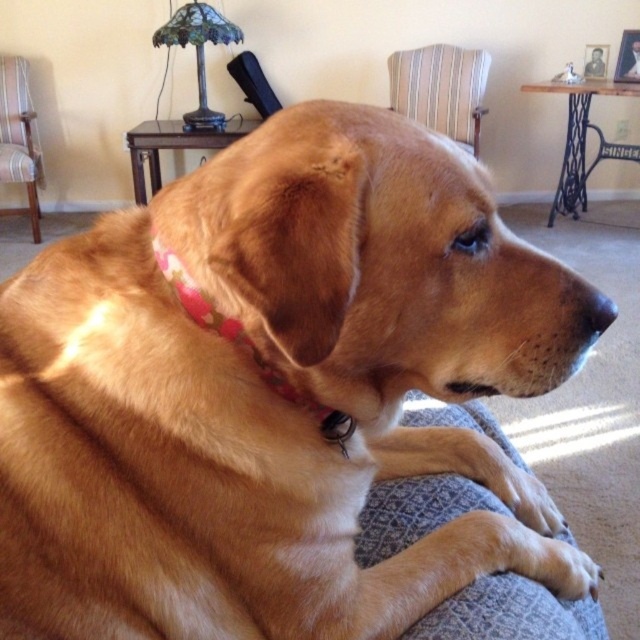
In the scene shown: Can you confirm if gray fabric dog bed at lower center is positioned below striped fabric armchair at upper center?

Indeed, gray fabric dog bed at lower center is positioned under striped fabric armchair at upper center.

Which is behind, point (460, 612) or point (483, 76)?

The point (483, 76) is behind.

At what (x,y) coordinates should I click in order to perform the action: click on gray fabric dog bed at lower center. Please return your answer as a coordinate pair (x, y). Image resolution: width=640 pixels, height=640 pixels. Looking at the image, I should click on (509, 612).

The width and height of the screenshot is (640, 640). Describe the element at coordinates (509, 612) in the screenshot. I see `gray fabric dog bed at lower center` at that location.

Which is above, gray fabric dog bed at lower center or floral fabric bandana at center?

Positioned higher is floral fabric bandana at center.

Between point (538, 600) and point (154, 241), which one is positioned in front?

Point (154, 241) is more forward.

Identify the location of gray fabric dog bed at lower center. This screenshot has width=640, height=640. (509, 612).

Is striped fabric armchair at upper center below floral fabric bandana at center?

Actually, striped fabric armchair at upper center is above floral fabric bandana at center.

Can you confirm if striped fabric armchair at upper center is thinner than floral fabric bandana at center?

In fact, striped fabric armchair at upper center might be wider than floral fabric bandana at center.

Between point (403, 83) and point (276, 378), which one is positioned behind?

Point (403, 83)

Find the location of `striped fabric armchair at upper center`. striped fabric armchair at upper center is located at coordinates (442, 90).